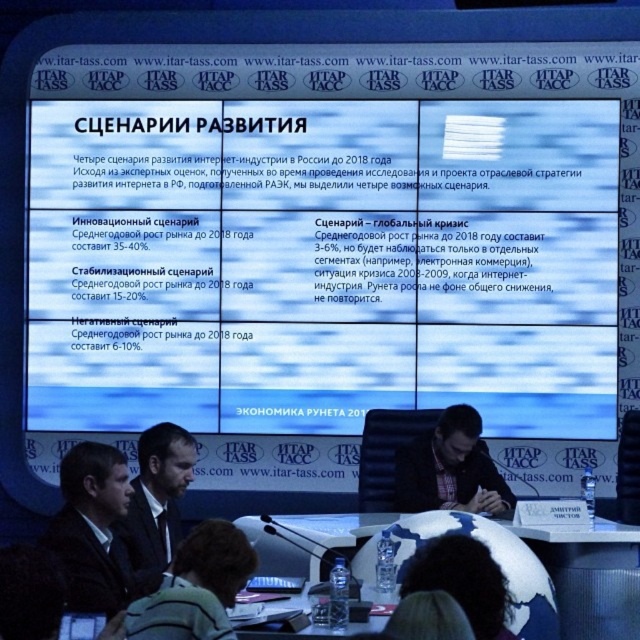
Question: Does dark suit at center have a smaller size compared to dark brown suit at center?

Choices:
 (A) no
 (B) yes

Answer: (B)

Question: Is white paper at center in front of dark brown suit at center?

Choices:
 (A) no
 (B) yes

Answer: (A)

Question: Is white paper at center in front of dark suit at center?

Choices:
 (A) no
 (B) yes

Answer: (A)

Question: Which object is closer to the camera taking this photo?

Choices:
 (A) white paper at center
 (B) dark brown hair at center
 (C) dark brown suit at center
 (D) white glossy table at center

Answer: (B)

Question: Which point appears farthest from the camera in this image?

Choices:
 (A) coord(163,451)
 (B) coord(324,220)
 (C) coord(560,593)

Answer: (B)

Question: Which object is farther from the camera taking this photo?

Choices:
 (A) dark brown hair at center
 (B) white glossy table at center

Answer: (B)